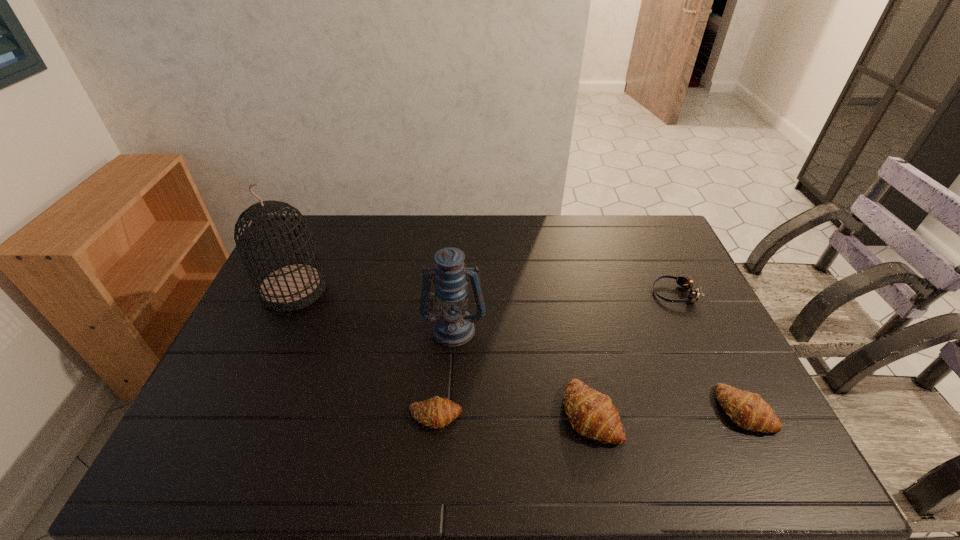
This screenshot has width=960, height=540. I want to click on vacant space that satisfies the following two spatial constraints: 1. on the back side of the rightmost crescent roll; 2. through the lenses of the goggles, so point(686,293).

At what (x,y) coordinates should I click in order to perform the action: click on vacant space that satisfies the following two spatial constraints: 1. on the front-facing side of the second tallest object; 2. on the left side of the rightmost crescent roll. Please return your answer as a coordinate pair (x, y). Looking at the image, I should click on (449, 410).

Where is `blank space that satisfies the following two spatial constraints: 1. through the lenses of the fourth tallest object; 2. on the right side of the goggles`? The height and width of the screenshot is (540, 960). blank space that satisfies the following two spatial constraints: 1. through the lenses of the fourth tallest object; 2. on the right side of the goggles is located at coordinates (729, 410).

The image size is (960, 540). What are the coordinates of `free spot that satisfies the following two spatial constraints: 1. on the back side of the shortest crescent roll; 2. on the left side of the third object from right to left` in the screenshot? It's located at (436, 413).

The width and height of the screenshot is (960, 540). I want to click on free space that satisfies the following two spatial constraints: 1. on the front side of the leftmost object; 2. on the right side of the second crescent roll from right to left, so click(x=237, y=413).